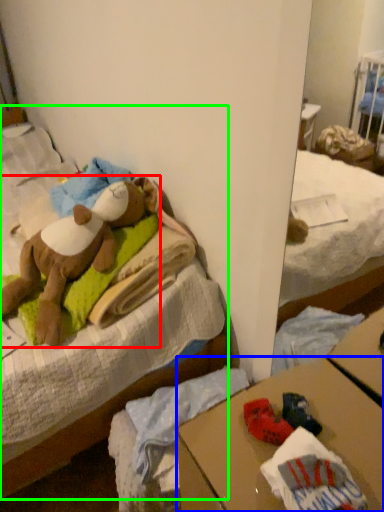
Question: Considering the real-world distances, which object is farthest from teddy bear (highlighted by a red box)? desk (highlighted by a blue box) or bed (highlighted by a green box)?

Choices:
 (A) desk
 (B) bed

Answer: (A)